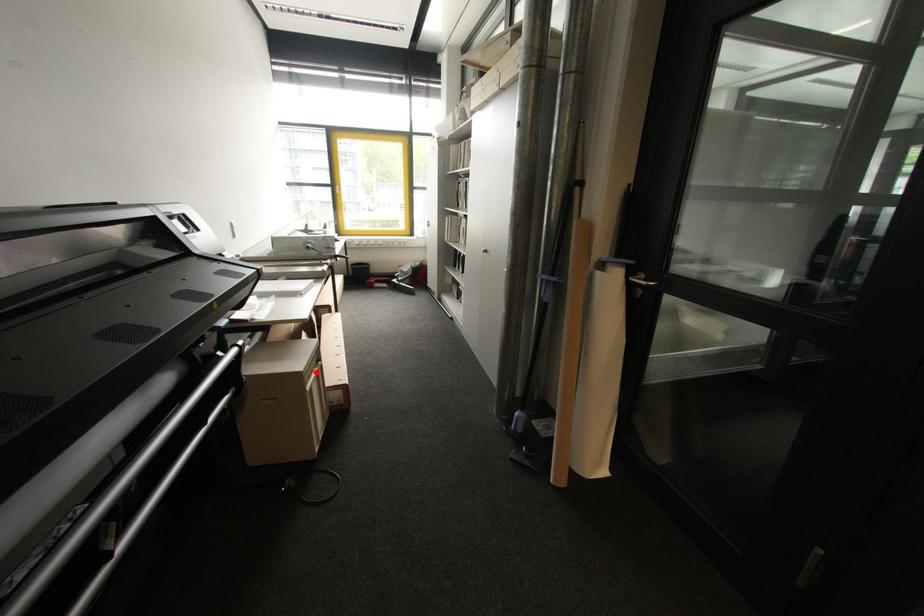
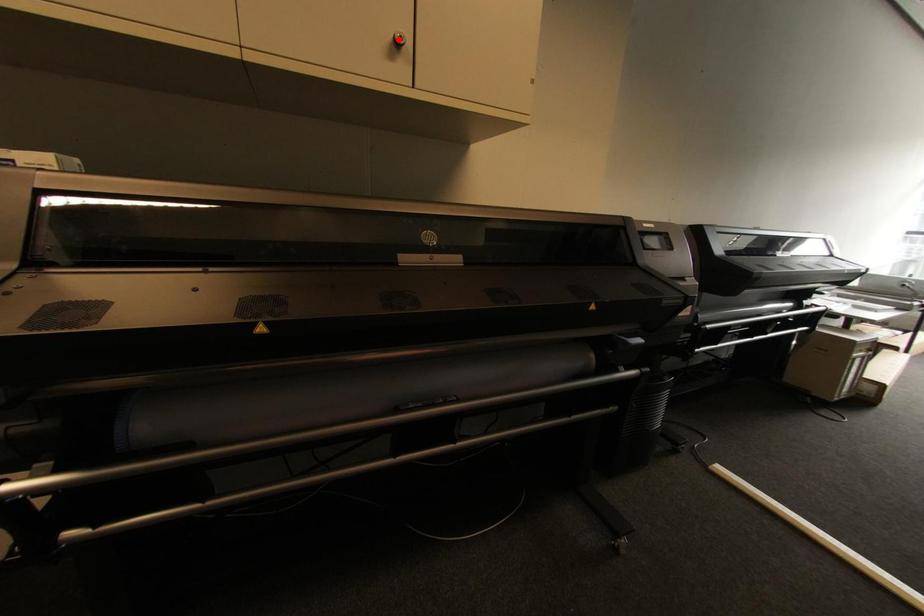
I am providing you with two images of the same scene from different viewpoints. A red point is marked on the first image and another point is marked on the second image. Are the points marked in image1 and image2 representing the same 3D position?

No